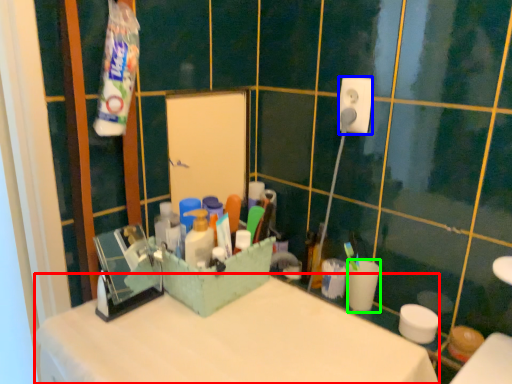
Question: Which object is the closest to the counter top (highlighted by a red box)? Choose among these: power plugs and sockets (highlighted by a blue box) or coffee cup (highlighted by a green box).

Choices:
 (A) power plugs and sockets
 (B) coffee cup

Answer: (B)